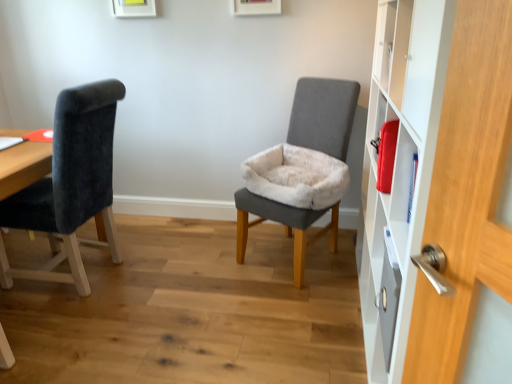
What are the coordinates of `vacant area located to the right-hand side of velvet black chair at left, marked as the first chair in a left-to-right arrangement` in the screenshot? It's located at (170, 274).